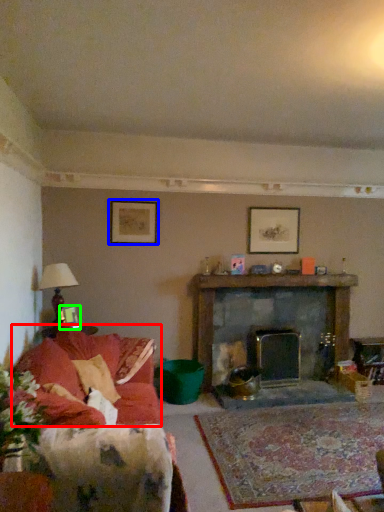
Question: Based on their relative distances, which object is nearer to couch (highlighted by a red box)? Choose from picture frame (highlighted by a blue box) and picture frame (highlighted by a green box).

Choices:
 (A) picture frame
 (B) picture frame

Answer: (B)